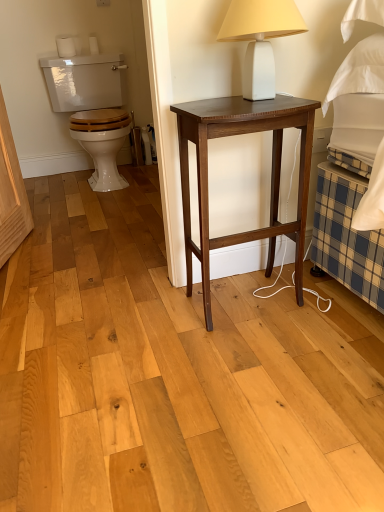
Locate an element on the screen. vacant space situated on the left part of dark wood nightstand at center is located at coordinates (157, 319).